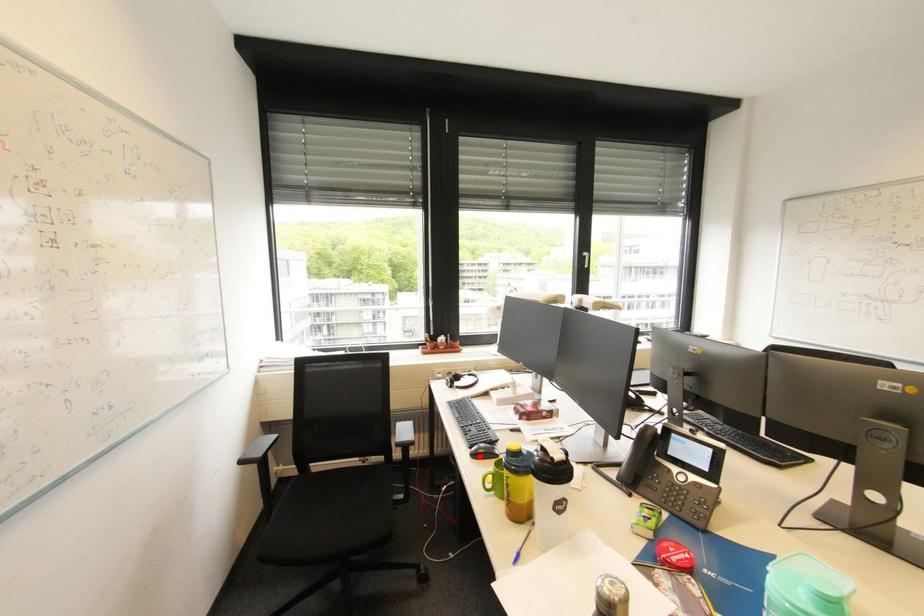
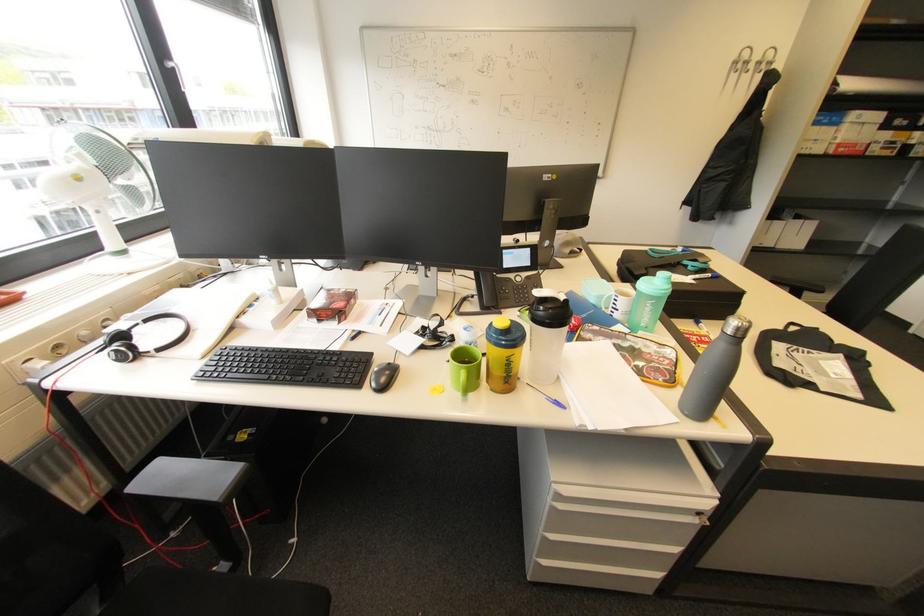
In the second image, find the point that corresponds to the highlighted location in the first image.

(387, 389)